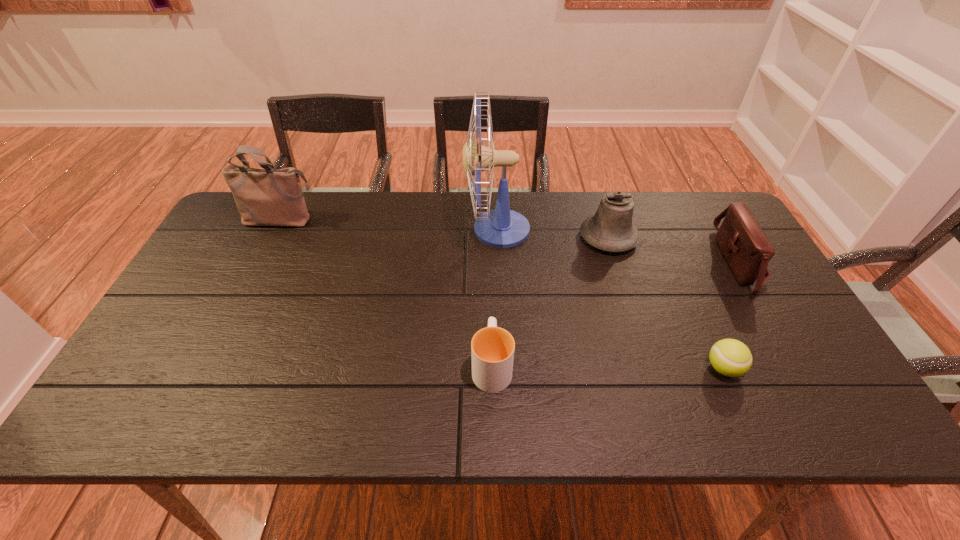
This screenshot has width=960, height=540. What are the coordinates of `fan` in the screenshot? It's located at (501, 227).

Locate an element on the screen. the left shoulder bag is located at coordinates (264, 197).

Find the location of `the taller shoulder bag`. the taller shoulder bag is located at coordinates (264, 197).

The height and width of the screenshot is (540, 960). What are the coordinates of `bell` in the screenshot? It's located at (610, 229).

Where is `the shorter shoulder bag`? the shorter shoulder bag is located at coordinates (746, 248).

Where is `the rightmost object`? the rightmost object is located at coordinates (746, 248).

Locate an element on the screen. The height and width of the screenshot is (540, 960). the fifth tallest object is located at coordinates (492, 348).

At what (x,y) coordinates should I click in order to perform the action: click on the shortest object. Please return your answer as a coordinate pair (x, y). Looking at the image, I should click on (730, 357).

The width and height of the screenshot is (960, 540). I want to click on the second object from right to left, so click(x=730, y=357).

The width and height of the screenshot is (960, 540). Identify the location of vacant space located 0.380m at the front of the tallest object where the blades are visible. (344, 230).